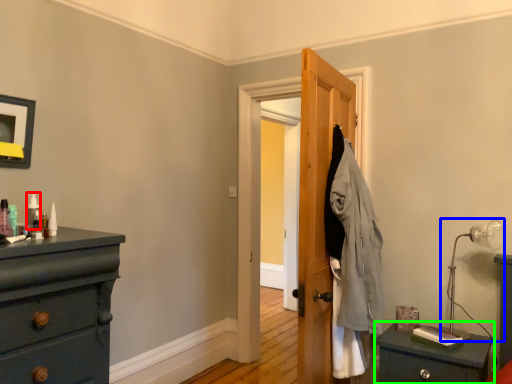
Question: Which object is positioned farthest from toiletry (highlighted by a red box)? Select from table lamp (highlighted by a blue box) and nightstand (highlighted by a green box).

Choices:
 (A) table lamp
 (B) nightstand

Answer: (A)